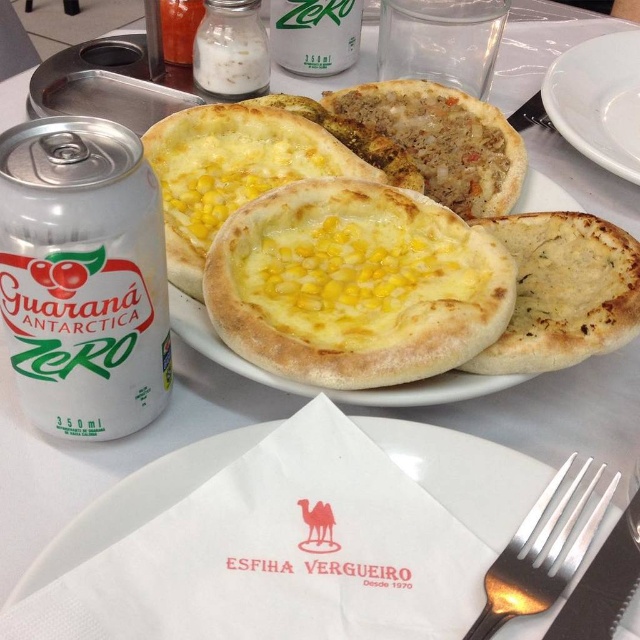
You are a food delivery person who needs to place a hot yellow cheesy bread at center and a white paper napkin at center on a small plate that can only hold items within a 5.00 inch diameter. Can both items fit on the plate without overlapping?

The yellow cheesy bread at center is 7.00 inches away from the white paper napkin at center, which exceeds the 5.00 inch diameter of the plate. Therefore, they cannot both fit on the plate without overlapping.

You are a food critic standing 1.5 meters away from the table. You want to take a photo of the yellow cheesy bread at center without moving any objects. Can you reach it with your camera lens that has a minimum focusing distance of 14 inches?

The yellow cheesy bread at center is 13.74 inches from camera, which is within the camera lens minimum focusing distance of 14 inches. Therefore, you can take the photo without moving any objects.

You are setting up a table for a dinner party and need to place a white metallic can at left and a silver metallic fork at lower right. Given their heights, which object will require more vertical space on the table?

The white metallic can at left requires more vertical space because it has a greater height compared to the silver metallic fork at lower right.